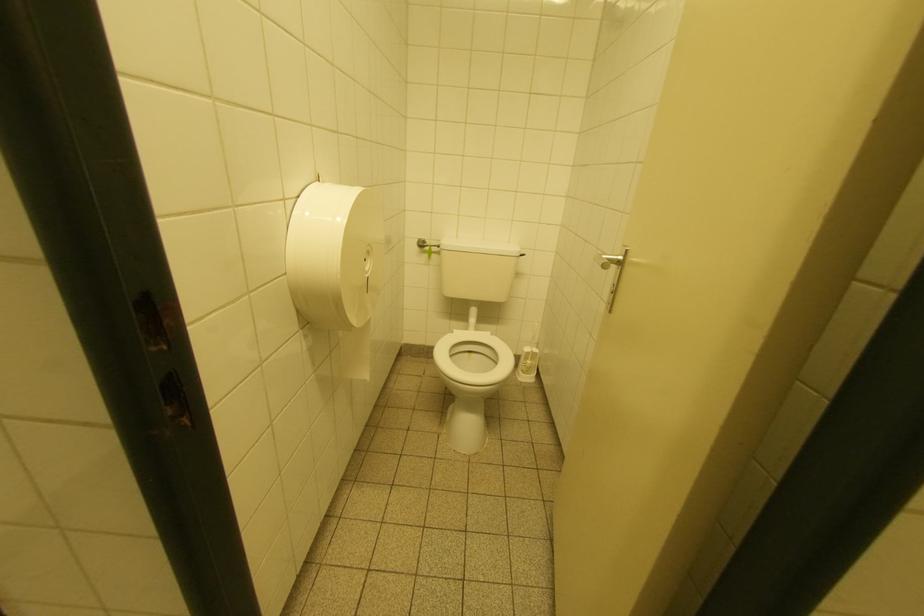
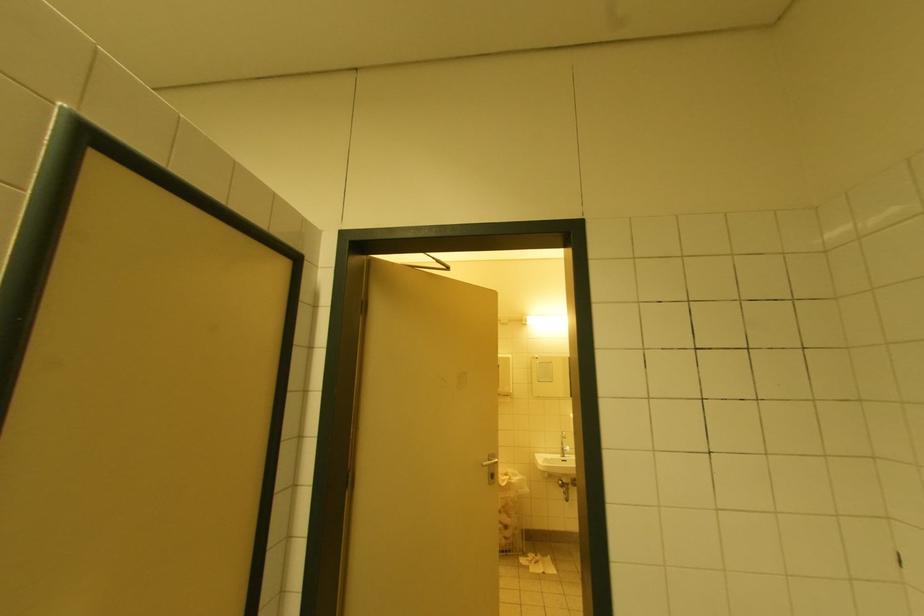
Question: The camera is either moving clockwise (left) or counter-clockwise (right) around the object. The first image is from the beginning of the video and the second image is from the end. Is the camera moving left or right when shooting the video?

Choices:
 (A) Left
 (B) Right

Answer: (A)